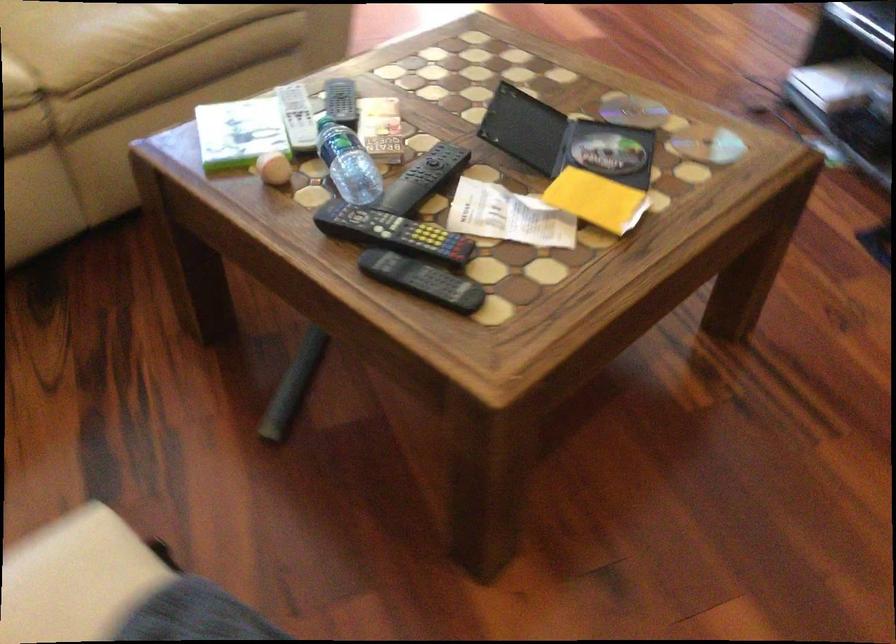
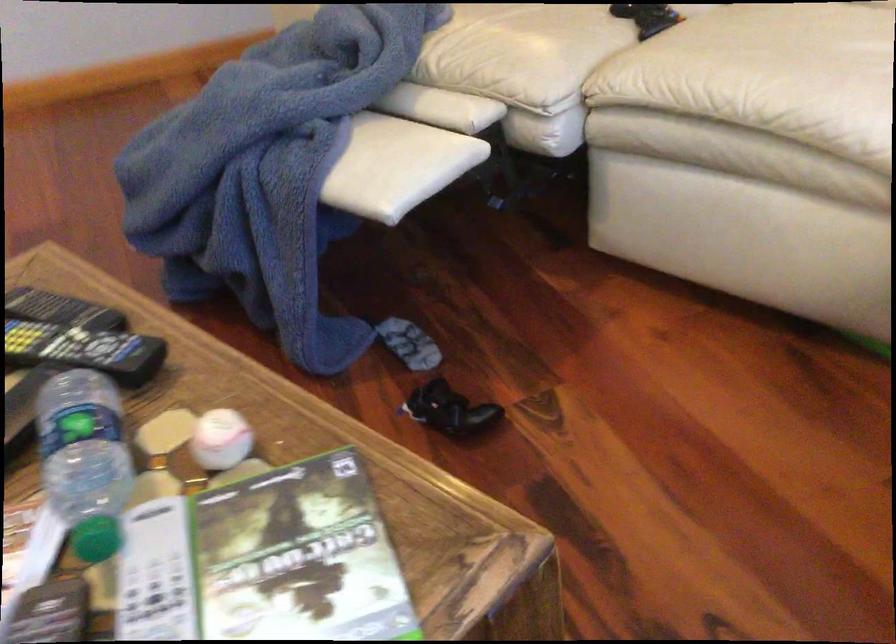
Find the pixel in the second image that matches pixel 314 115 in the first image.

(156, 574)